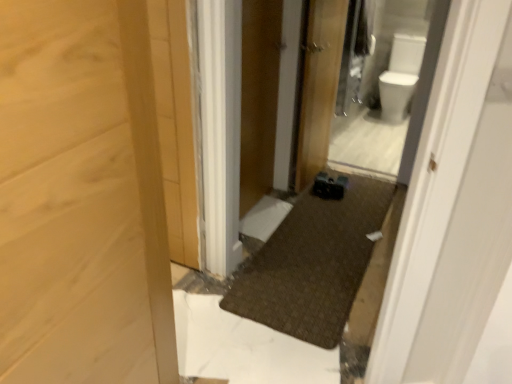
Question: From a real-world perspective, is white glossy toilet bowl at upper right positioned under wooden door at center based on gravity?

Choices:
 (A) no
 (B) yes

Answer: (B)

Question: From the image's perspective, is white glossy toilet bowl at upper right beneath wooden door at center?

Choices:
 (A) no
 (B) yes

Answer: (A)

Question: Considering the relative positions of white glossy toilet bowl at upper right and wooden door at center in the image provided, is white glossy toilet bowl at upper right behind wooden door at center?

Choices:
 (A) no
 (B) yes

Answer: (B)

Question: Are white glossy toilet bowl at upper right and wooden door at center making contact?

Choices:
 (A) yes
 (B) no

Answer: (B)

Question: Can you confirm if white glossy toilet bowl at upper right is smaller than wooden door at center?

Choices:
 (A) yes
 (B) no

Answer: (B)

Question: Is point (391, 51) closer or farther from the camera than point (312, 162)?

Choices:
 (A) closer
 (B) farther

Answer: (B)

Question: From the image's perspective, is white glossy toilet bowl at upper right positioned above or below wooden door at center?

Choices:
 (A) above
 (B) below

Answer: (A)

Question: In terms of width, does white glossy toilet bowl at upper right look wider or thinner when compared to wooden door at center?

Choices:
 (A) thin
 (B) wide

Answer: (B)

Question: From a real-world perspective, relative to wooden door at center, is white glossy toilet bowl at upper right vertically above or below?

Choices:
 (A) below
 (B) above

Answer: (A)

Question: Considering the positions of point (253, 107) and point (313, 76), is point (253, 107) closer or farther from the camera than point (313, 76)?

Choices:
 (A) closer
 (B) farther

Answer: (A)

Question: Is wooden screen door at center taller or shorter than wooden door at center?

Choices:
 (A) tall
 (B) short

Answer: (A)

Question: In the image, is wooden screen door at center positioned in front of or behind wooden door at center?

Choices:
 (A) front
 (B) behind

Answer: (A)

Question: From the image's perspective, relative to wooden door at center, is wooden screen door at center above or below?

Choices:
 (A) below
 (B) above

Answer: (A)

Question: Looking at their shapes, would you say wooden door at center is wider or thinner than wooden screen door at center?

Choices:
 (A) thin
 (B) wide

Answer: (B)

Question: From their relative heights in the image, would you say wooden door at center is taller or shorter than wooden screen door at center?

Choices:
 (A) short
 (B) tall

Answer: (A)